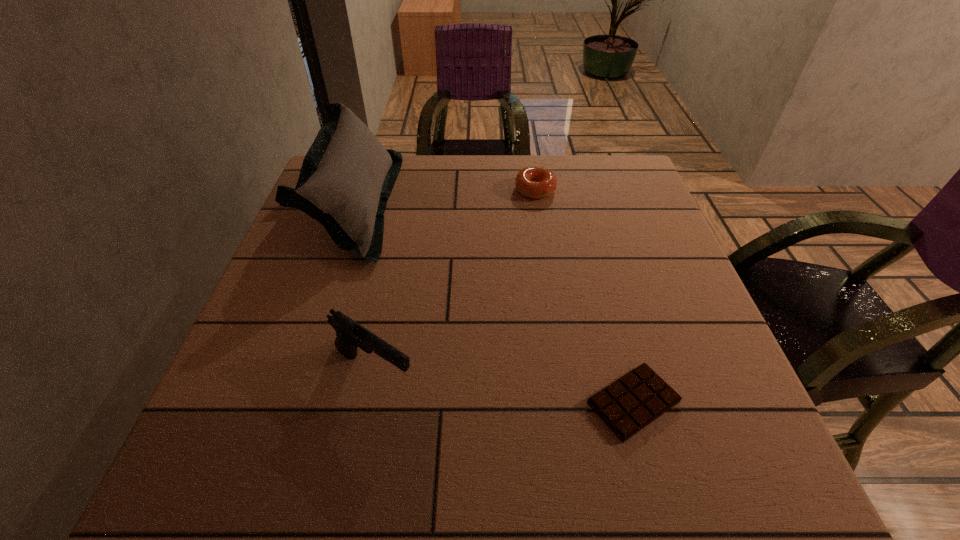
Where is `object at the near edge`? object at the near edge is located at coordinates [x=632, y=402].

Find the location of `object present at the left edge`. object present at the left edge is located at coordinates (347, 176).

The height and width of the screenshot is (540, 960). I want to click on object situated at the right edge, so click(632, 402).

At what (x,y) coordinates should I click in order to perform the action: click on object at the far left corner. Please return your answer as a coordinate pair (x, y). Image resolution: width=960 pixels, height=540 pixels. Looking at the image, I should click on point(347,176).

Locate an element on the screen. The image size is (960, 540). object at the near right corner is located at coordinates (632, 402).

This screenshot has width=960, height=540. What are the coordinates of `vacant space at the far edge of the desktop` in the screenshot? It's located at (409, 168).

The width and height of the screenshot is (960, 540). In the image, there is a desktop. Identify the location of vacant space at the near edge. (328, 459).

You are a GUI agent. You are given a task and a screenshot of the screen. Output one action in this format:
    pyautogui.click(x=<x>, y=<y>)
    Task: Click on the vacant region at the left edge of the desktop
    
    Given the screenshot: What is the action you would take?
    pyautogui.click(x=282, y=328)

Find the location of a particular element. vacant space at the right edge of the desktop is located at coordinates (671, 376).

Image resolution: width=960 pixels, height=540 pixels. In the image, there is a desktop. Find the location of `free space at the near left corner`. free space at the near left corner is located at coordinates (241, 448).